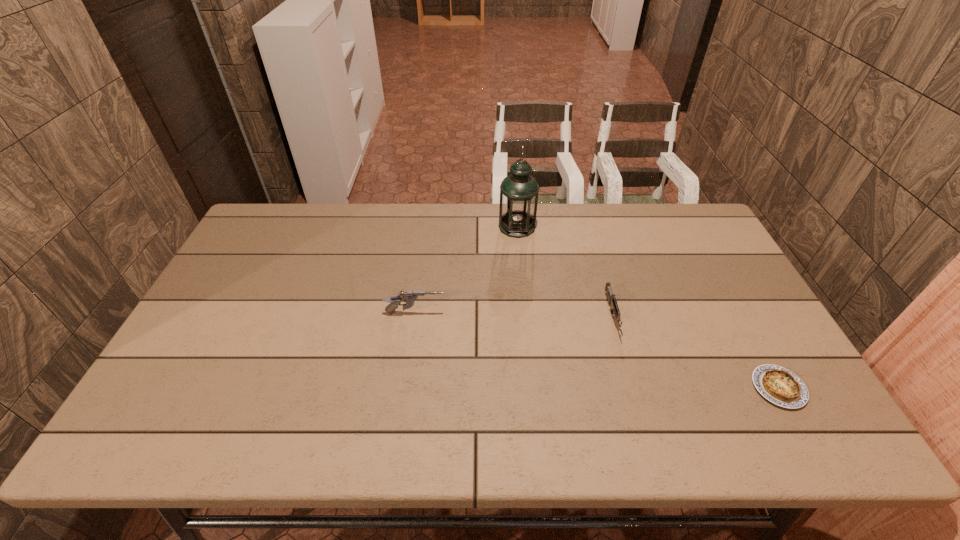
The width and height of the screenshot is (960, 540). Identify the location of oil lamp. (519, 191).

Find the location of `the farthest object`. the farthest object is located at coordinates (519, 191).

Where is `the leftmost object`? The width and height of the screenshot is (960, 540). the leftmost object is located at coordinates (410, 297).

Identify the location of the taller gun. (410, 297).

Find the location of `the right gun`. the right gun is located at coordinates (612, 300).

I want to click on the second object from right to left, so click(612, 300).

Image resolution: width=960 pixels, height=540 pixels. In order to click on quiche in this screenshot , I will do `click(777, 384)`.

Locate an element on the screen. The height and width of the screenshot is (540, 960). the nearest object is located at coordinates pyautogui.click(x=777, y=384).

I want to click on vacant area situated on the front of the farthest object, so click(523, 294).

Where is `vacant region located 0.380m at the barrel of the third shortest object`? Image resolution: width=960 pixels, height=540 pixels. vacant region located 0.380m at the barrel of the third shortest object is located at coordinates (581, 313).